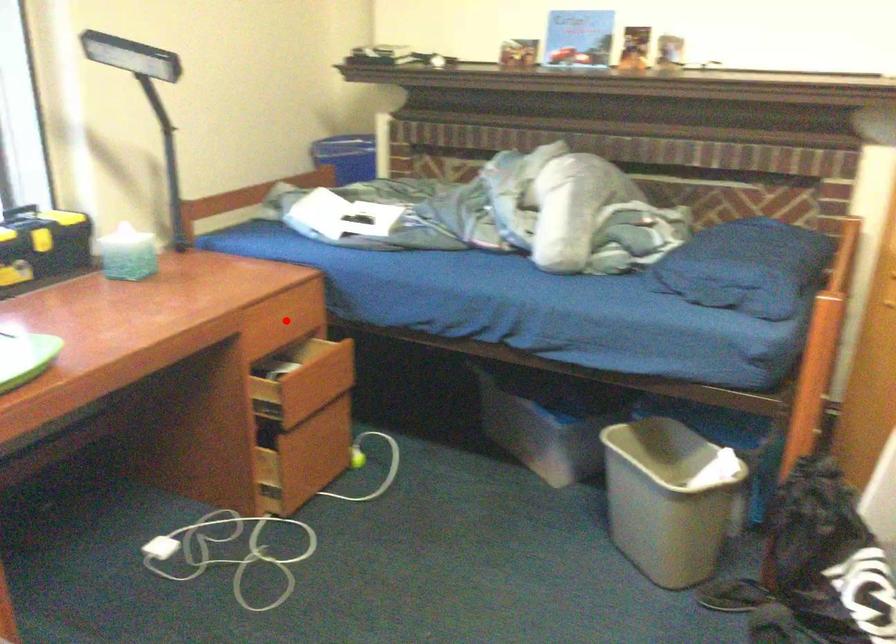
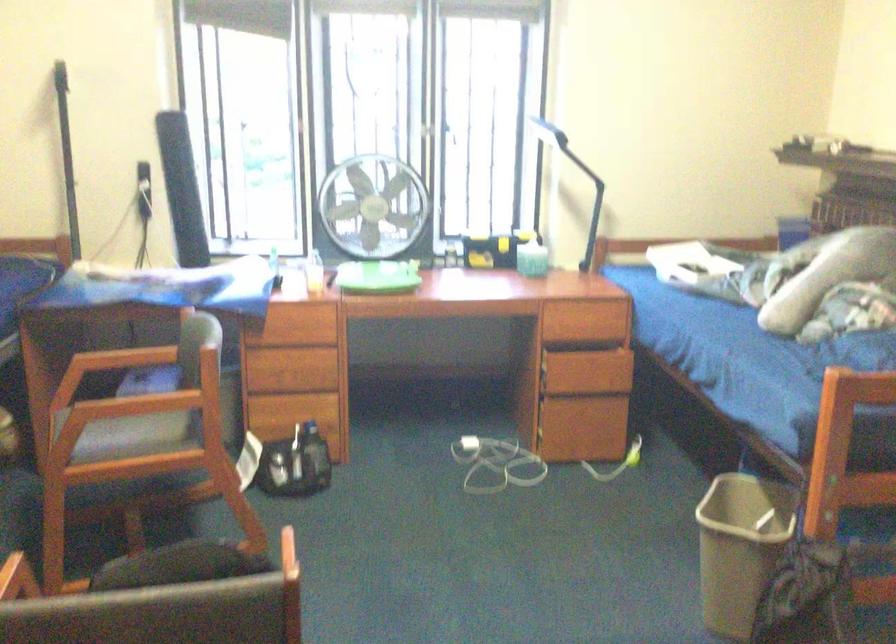
Question: A red point is marked in image1. In image2, is the corresponding 3D point closer to the camera or farther? Reply with the corresponding letter.

Choices:
 (A) The corresponding 3D point is closer.
 (B) The corresponding 3D point is farther.

Answer: (B)